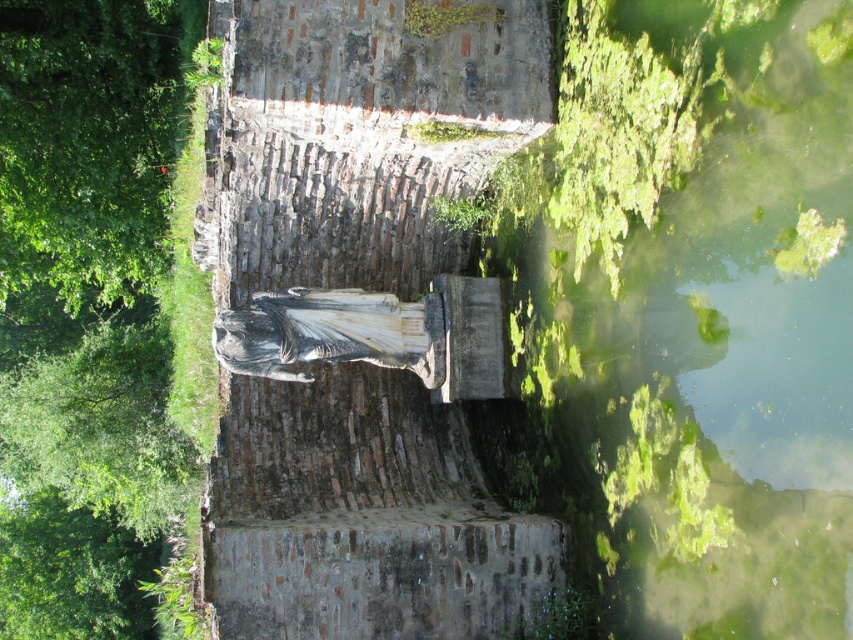
You are an artist planning to paint the scene. You need to decide which object, the green mossy stone statue at center or the green leafy tree at upper left, requires more attention to detail due to its smaller size. Which one should you focus on?

The green mossy stone statue at center requires more attention to detail because its width is smaller than the green leafy tree at upper left.

Based on the photo, you are standing in the outdoor scene looking at the stone wall and statue. There are two points marked on the image, one at coordinates point (425, 118) and another at point (78, 378). Which of these points is nearer to your viewpoint?

Point (425, 118) is closer to the camera than point (78, 378), so the point at coordinates point (425, 118) is nearer to your viewpoint.